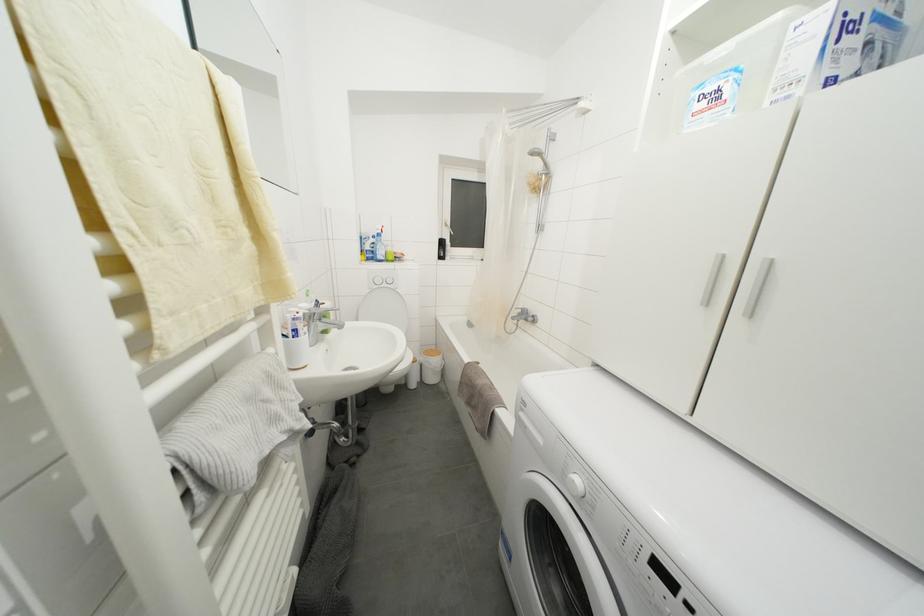
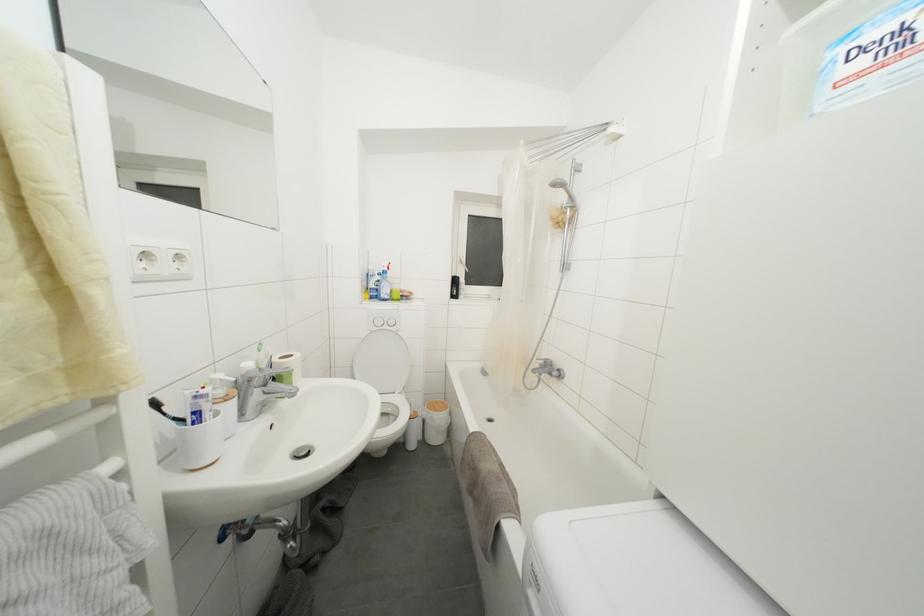
Locate, in the second image, the point that corresponds to [374,261] in the first image.

(379, 300)